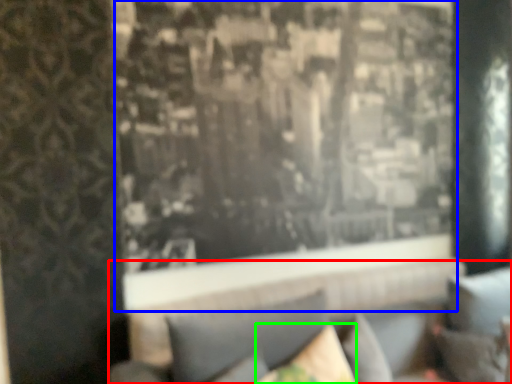
Question: Which object is the closest to the couch (highlighted by a red box)? Choose among these: window (highlighted by a blue box) or pillow (highlighted by a green box).

Choices:
 (A) window
 (B) pillow

Answer: (B)